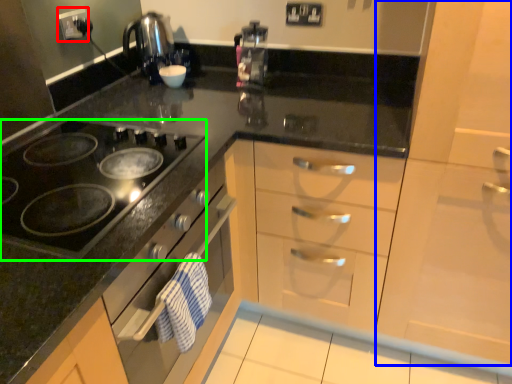
Question: Based on their relative distances, which object is farther from electric outlet (highlighted by a red box)? Choose from cabinetry (highlighted by a blue box) and gas stove (highlighted by a green box).

Choices:
 (A) cabinetry
 (B) gas stove

Answer: (A)